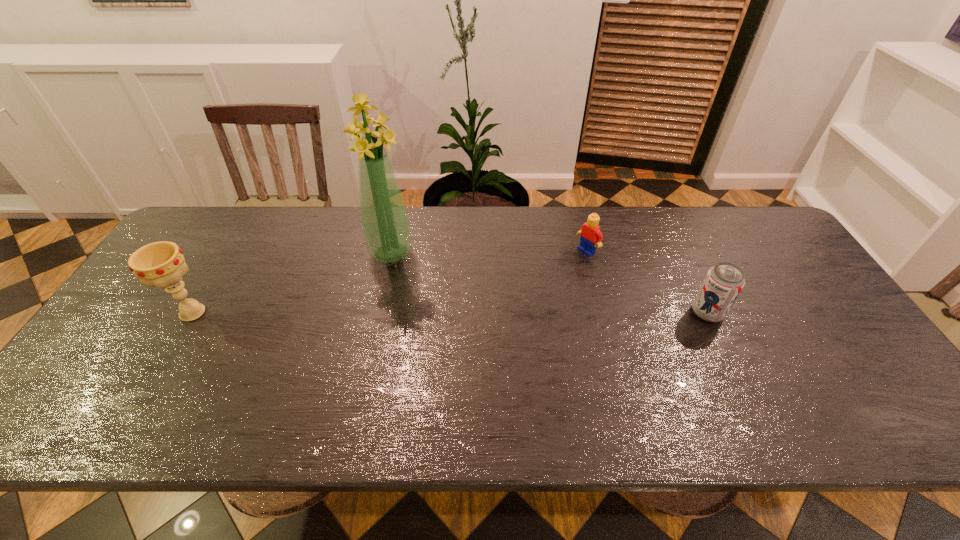
Locate an element on the screen. vacant region between the chalice and the beer can is located at coordinates (450, 313).

Where is `unoccupied position between the leftmost object and the tallest object`? This screenshot has height=540, width=960. unoccupied position between the leftmost object and the tallest object is located at coordinates (x=292, y=283).

Where is `free point between the leftmost object and the rightmost object`? The width and height of the screenshot is (960, 540). free point between the leftmost object and the rightmost object is located at coordinates (450, 313).

The height and width of the screenshot is (540, 960). Find the location of `vacant point located between the chalice and the beer can`. vacant point located between the chalice and the beer can is located at coordinates (450, 313).

At what (x,y) coordinates should I click in order to perform the action: click on free point between the third shortest object and the tallest object. Please return your answer as a coordinate pair (x, y). Image resolution: width=960 pixels, height=540 pixels. Looking at the image, I should click on (292, 283).

Identify which object is the second nearest to the leftmost object. Please provide its 2D coordinates. Your answer should be formatted as a tuple, i.e. [(x, y)], where the tuple contains the x and y coordinates of a point satisfying the conditions above.

[(591, 236)]

Choose which object is the third nearest neighbor to the rightmost object. Please provide its 2D coordinates. Your answer should be formatted as a tuple, i.e. [(x, y)], where the tuple contains the x and y coordinates of a point satisfying the conditions above.

[(160, 264)]

Where is `free space that satisfies the following two spatial constraints: 1. on the front side of the bouquet; 2. on the left side of the beer can`? The image size is (960, 540). free space that satisfies the following two spatial constraints: 1. on the front side of the bouquet; 2. on the left side of the beer can is located at coordinates (378, 313).

In order to click on free spot that satisfies the following two spatial constraints: 1. on the back side of the chalice; 2. on the right side of the second object from right to left in this screenshot , I will do `click(229, 251)`.